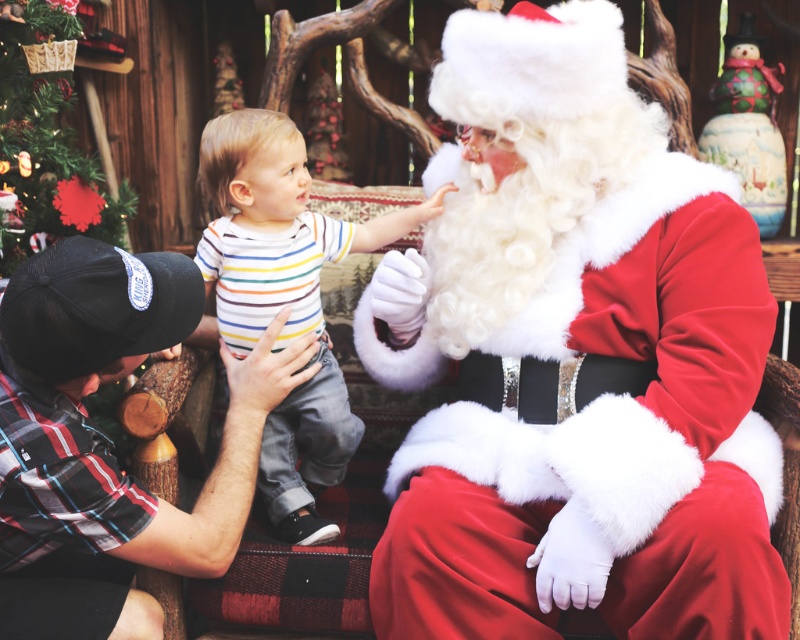
Does striped cotton shirt at center have a lesser width compared to green matte christmas tree at upper left?

No.

Based on the photo, can you confirm if striped cotton shirt at center is positioned to the right of green matte christmas tree at upper left?

Indeed, striped cotton shirt at center is positioned on the right side of green matte christmas tree at upper left.

Measure the distance between striped cotton shirt at center and camera.

The distance of striped cotton shirt at center from camera is 1.77 meters.

The image size is (800, 640). In order to click on striped cotton shirt at center in this screenshot , I will do `click(284, 298)`.

Between point (80, 499) and point (97, 186), which one is positioned in front?

Point (80, 499) is in front.

Does point (258, 388) come behind point (88, 205)?

No, (258, 388) is closer to viewer.

Where is `plaid shirt at lower left`? Image resolution: width=800 pixels, height=640 pixels. plaid shirt at lower left is located at coordinates (96, 429).

Which of these two, velvet red santa at center or striped cotton shirt at center, stands shorter?

striped cotton shirt at center is shorter.

What do you see at coordinates (574, 358) in the screenshot? The height and width of the screenshot is (640, 800). I see `velvet red santa at center` at bounding box center [574, 358].

You are a GUI agent. You are given a task and a screenshot of the screen. Output one action in this format:
    pyautogui.click(x=<x>, y=<y>)
    Task: Click on the velvet red santa at center
    The width and height of the screenshot is (800, 640).
    Given the screenshot: What is the action you would take?
    pyautogui.click(x=574, y=358)